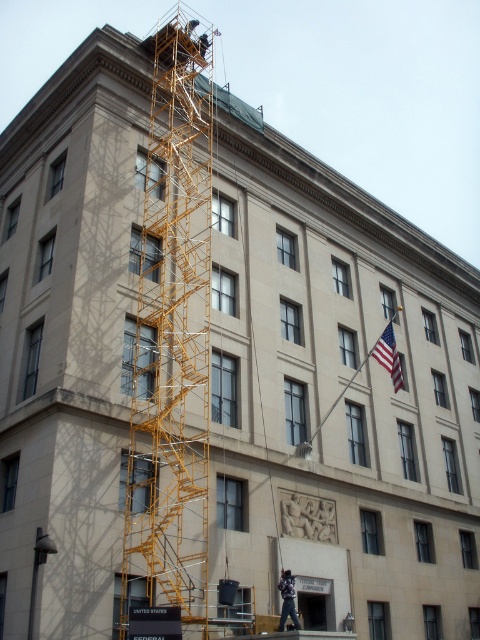
You are standing in front of a classical building with scaffolding. You see an american flag at upper right and dark blue jeans at lower center. Which object is higher up in the image?

The american flag at upper right is located above dark blue jeans at lower center, so the american flag at upper right is higher up in the image.

You are a construction worker standing on the ground floor of the building. You see the yellow metal scaffolding at upper left and the dark blue jeans at lower center. Which object is higher from the ground?

The yellow metal scaffolding at upper left is above dark blue jeans at lower center, so the yellow metal scaffolding at upper left is higher from the ground.